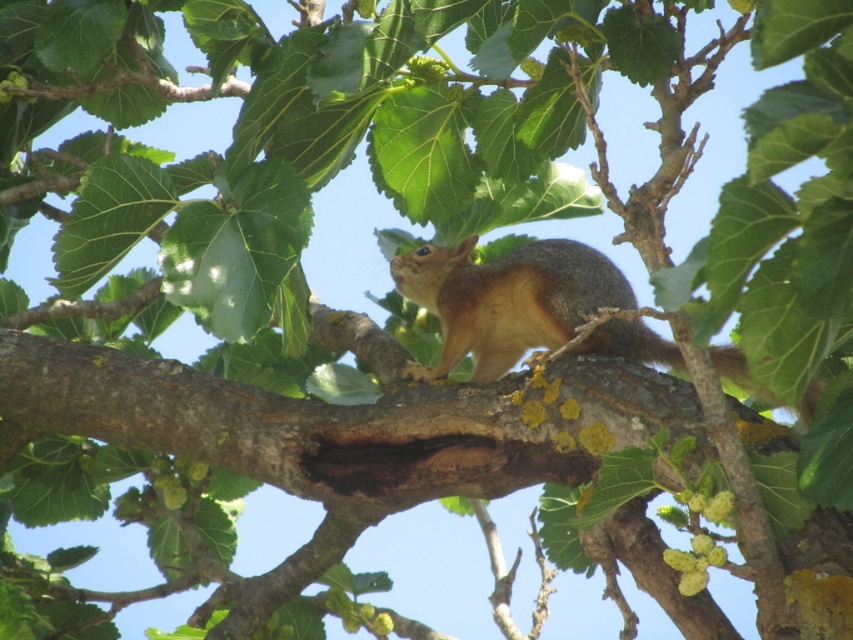
You are a bird flying towards the shiny brown fur squirrel at center and the brown furry tail at right. Which one will you reach first?

You will reach the shiny brown fur squirrel at center first because it is closer to you than the brown furry tail at right, which is further away.